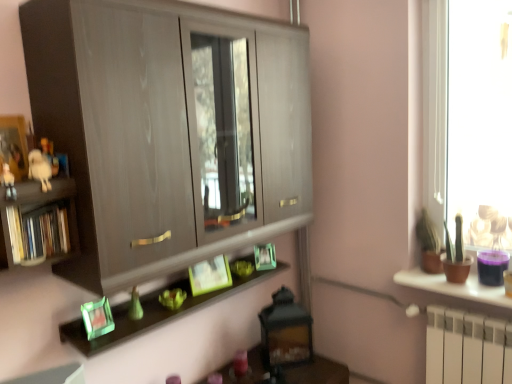
Question: Would you say green glass picture frame at lower left, which ranks as the 1th picture frame in front-to-back order, is to the left or to the right of green matte picture frame at center, the first picture frame viewed from the back, in the picture?

Choices:
 (A) left
 (B) right

Answer: (A)

Question: Is green glass picture frame at lower left, the first picture frame when ordered from left to right, in front of or behind green matte picture frame at center, which is the 3th picture frame from left to right, in the image?

Choices:
 (A) front
 (B) behind

Answer: (A)

Question: Which is farther from the white plush toy at left?

Choices:
 (A) white matte figurine at left
 (B) green matte picture frame at center, positioned as the second picture frame in left-to-right order
 (C) green matte cactus at right, the first houseplant viewed from the front
 (D) green matte picture frame at center, the 3th picture frame positioned from the front
 (E) wooden books at left

Answer: (C)

Question: Which object is positioned closest to the white plush toy at left?

Choices:
 (A) wooden books at left
 (B) white matte figurine at left
 (C) green matte plant at right, the 2th houseplant in the front-to-back sequence
 (D) green matte picture frame at center, which appears as the 2th picture frame when viewed from the back
 (E) green matte picture frame at center, the 3th picture frame positioned from the front

Answer: (B)